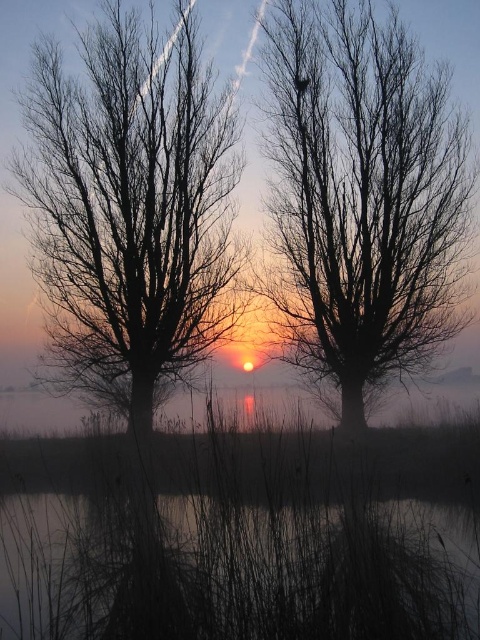
Question: Does black matte tree at center come behind dark matte water at lower center?

Choices:
 (A) yes
 (B) no

Answer: (A)

Question: Which object appears closest to the camera in this image?

Choices:
 (A) dark matte water at lower center
 (B) black matte tree at center
 (C) black matte tree at left

Answer: (A)

Question: Is black matte tree at center thinner than black matte tree at left?

Choices:
 (A) no
 (B) yes

Answer: (A)

Question: Is black matte tree at center to the left of black matte tree at left from the viewer's perspective?

Choices:
 (A) no
 (B) yes

Answer: (A)

Question: Which object is positioned closest to the dark matte water at lower center?

Choices:
 (A) black matte tree at center
 (B) black matte tree at left

Answer: (A)

Question: Which of the following is the closest to the observer?

Choices:
 (A) (38, 227)
 (B) (298, 179)

Answer: (A)